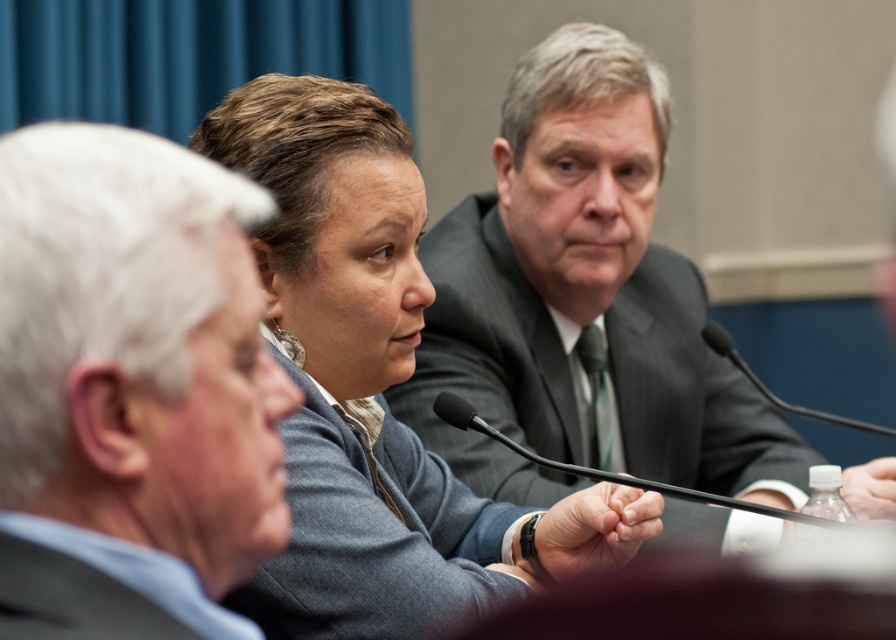
You are standing in front of the conference table and need to place a small object on the table. You have two points marked on the table as reference. The first point is at coordinates point (203, 202) and the second is at point (372, 566). Which point is closer to you?

The point at coordinates point (203, 202) is closer to the viewer than point (372, 566), so you should place the object there if you want it nearer to your position.

Based on the photo, you are organizing a meeting and want to place a name tag for the gray suit at center exactly at its current position. What coordinates should you use for the name tag placement?

The gray suit at center is located at coordinates point (136, 348), so the name tag should be placed at those coordinates.

In the scene described, there is a point located at coordinates (136, 348). Which object from the list corresponds to this point?

The point at (136, 348) corresponds to the gray suit at center.